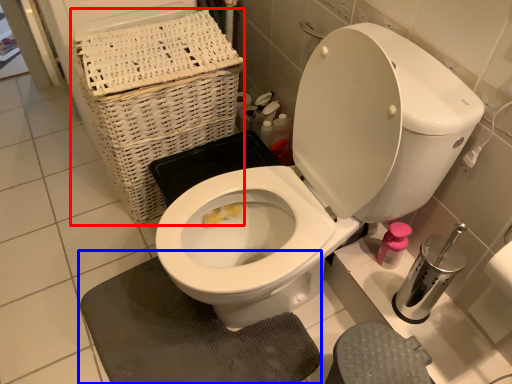
Question: Which object is closer to the camera taking this photo, basket (highlighted by a red box) or bath mat (highlighted by a blue box)?

Choices:
 (A) basket
 (B) bath mat

Answer: (B)